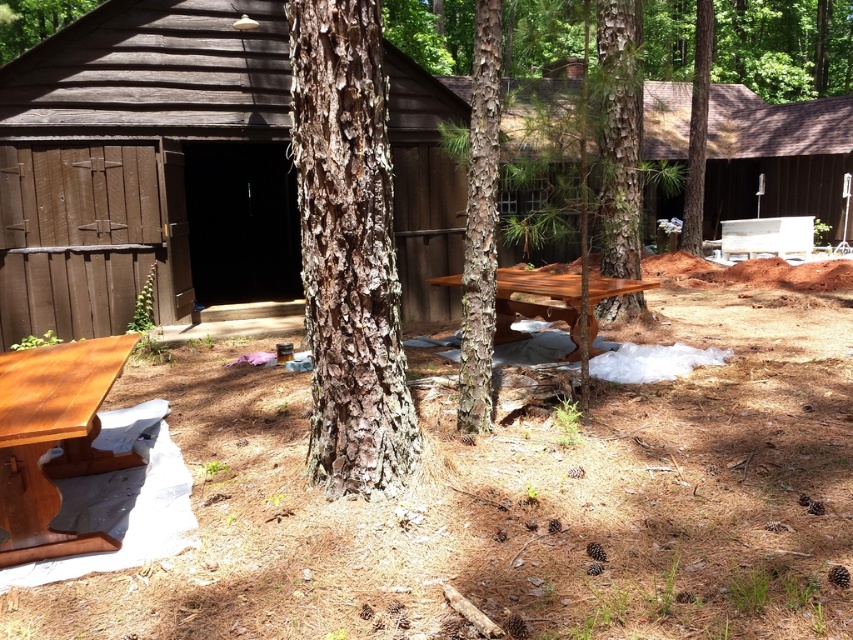
Is smooth reddish-brown wood picnic table at center thinner than brown rough bark tree at upper left?

Indeed, smooth reddish-brown wood picnic table at center has a lesser width compared to brown rough bark tree at upper left.

Looking at this image, who is shorter, smooth reddish-brown wood picnic table at center or brown rough bark tree at upper left?

Standing shorter between the two is smooth reddish-brown wood picnic table at center.

Does point (601, 292) come farther from viewer compared to point (6, 8)?

No, it is not.

Where is `smooth reddish-brown wood picnic table at center`? This screenshot has width=853, height=640. smooth reddish-brown wood picnic table at center is located at coordinates (537, 301).

Between brown rough bark tree at upper left and white painted wood bench at center right, which one has less height?

white painted wood bench at center right

Is brown rough bark tree at upper left thinner than white painted wood bench at center right?

No.

Which is behind, point (55, 19) or point (759, 246)?

Point (55, 19)

Where is `brown rough bark tree at upper left`? The height and width of the screenshot is (640, 853). brown rough bark tree at upper left is located at coordinates (35, 20).

Is brown wood cabin at center positioned in front of smooth bark tree at center?

Yes, it is.

Is point (187, 163) in front of point (700, 72)?

Yes, point (187, 163) is closer to viewer.

Between point (148, 134) and point (694, 77), which one is positioned behind?

Point (694, 77)

At what (x,y) coordinates should I click in order to perform the action: click on brown wood cabin at center. Please return your answer as a coordinate pair (x, y). Looking at the image, I should click on (144, 166).